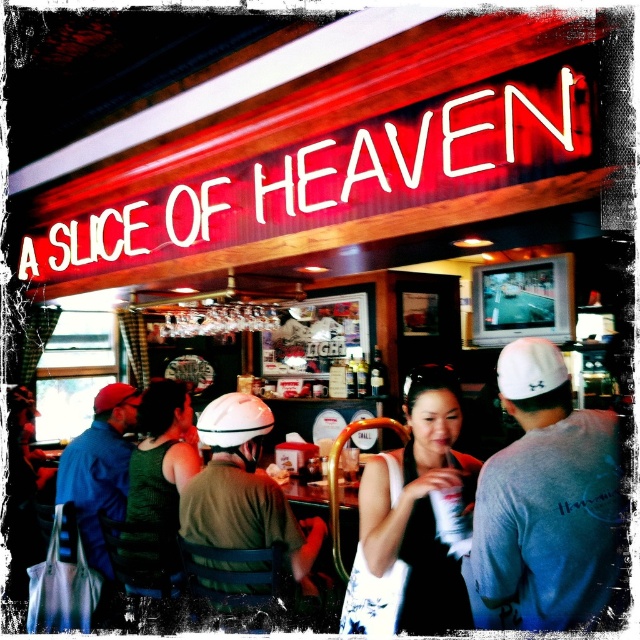
Question: Which point appears farthest from the camera in this image?

Choices:
 (A) (173, 564)
 (B) (364, 621)
 (C) (506, 516)

Answer: (A)

Question: Can you confirm if white fabric baseball cap at right is positioned above white matte baseball hat at center?

Choices:
 (A) yes
 (B) no

Answer: (A)

Question: Can you confirm if matte green helmet at center is thinner than white fabric baseball cap at right?

Choices:
 (A) yes
 (B) no

Answer: (B)

Question: Which of the following is the farthest from the observer?

Choices:
 (A) green fabric tank top at center
 (B) black fabric dress at center

Answer: (A)

Question: Among these objects, which one is nearest to the camera?

Choices:
 (A) black fabric dress at center
 (B) white matte baseball hat at center
 (C) green fabric tank top at center
 (D) blue denim jacket at left

Answer: (A)

Question: Does green fabric tank top at center appear under blue denim jacket at left?

Choices:
 (A) yes
 (B) no

Answer: (B)